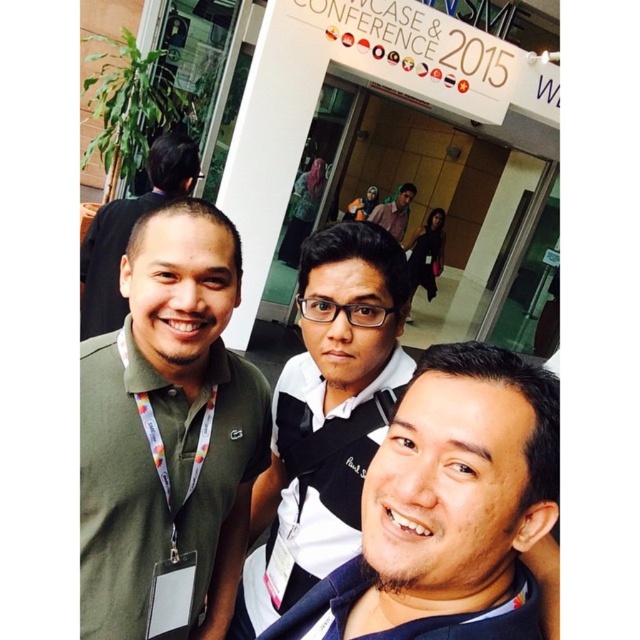
You are standing at the entrance of the conference and want to take a photo of the person wearing the black matte shirt at center. According to the coordinates given, where should you aim your camera to capture them?

The black matte shirt at center is located at coordinates point (324, 417), so aim your camera there to capture them.